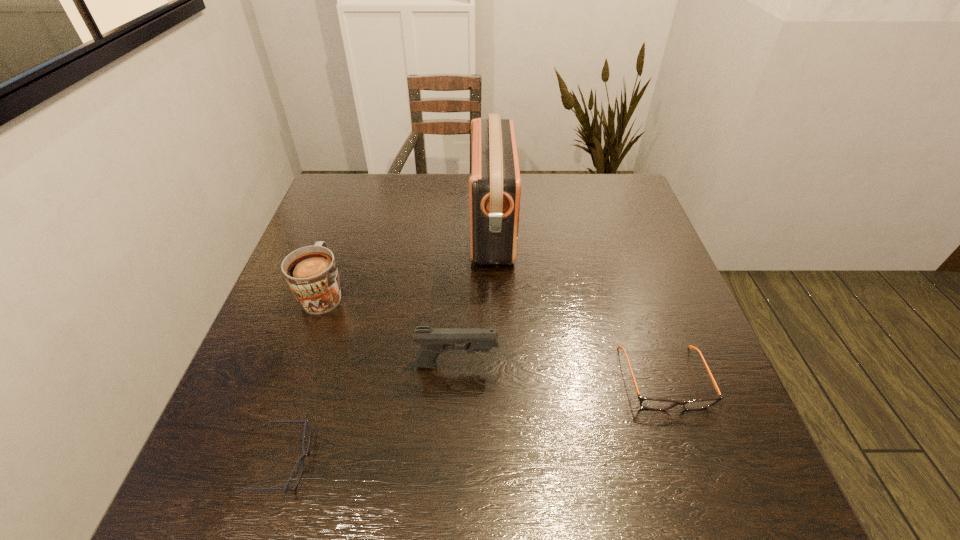
Identify the location of free space located 0.100m on the side of the mug with the handle. (341, 244).

Where is `vacant area located on the side of the mug with the handle`? vacant area located on the side of the mug with the handle is located at coordinates (362, 186).

Identify the location of vacant area situated on the side of the mug with the handle. The width and height of the screenshot is (960, 540). (348, 222).

Find the location of a particular element. vacant space located 0.180m at the barrel of the pistol is located at coordinates (585, 364).

I want to click on vacant region located 0.080m on the front-facing side of the right spectacles, so click(691, 456).

Where is `vacant space located on the front-facing side of the nearer spectacles`? This screenshot has height=540, width=960. vacant space located on the front-facing side of the nearer spectacles is located at coordinates (409, 462).

The width and height of the screenshot is (960, 540). I want to click on object that is at the far edge, so click(495, 184).

Locate an element on the screen. object that is at the near edge is located at coordinates (302, 457).

Locate an element on the screen. mug positioned at the left edge is located at coordinates (311, 273).

Image resolution: width=960 pixels, height=540 pixels. Identify the location of spectacles that is at the left edge. (302, 457).